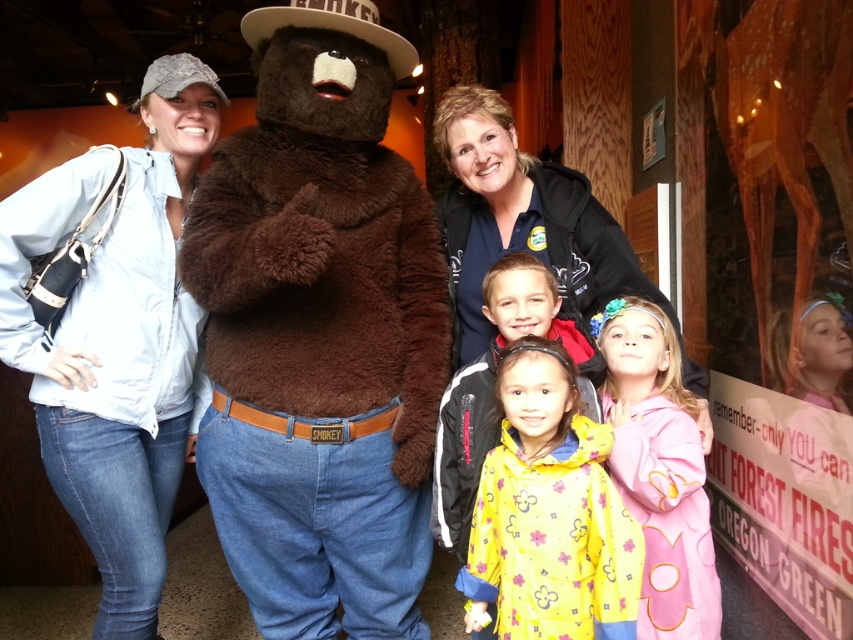
You are a photographer trying to capture a clear shot of the blue fleece jacket at upper center and the matte pink hoodie at center. Based on their heights, which one might require you to adjust your camera angle upwards to get both in focus?

The blue fleece jacket at upper center is taller than the matte pink hoodie at center, so you would need to adjust your camera angle upwards to include the taller blue fleece jacket at upper center in the frame while keeping the matte pink hoodie at center in focus.

You are a photographer trying to capture a photo of the fuzzy brown bear at center and the light blue denim jeans at left. Since the bear is taller, where should you position the camera to ensure both subjects are fully visible in the frame?

To ensure both the fuzzy brown bear at center and the light blue denim jeans at left are fully visible, position the camera at a lower angle so that the taller fuzzy brown bear at center doesn t block the shorter light blue denim jeans at left.